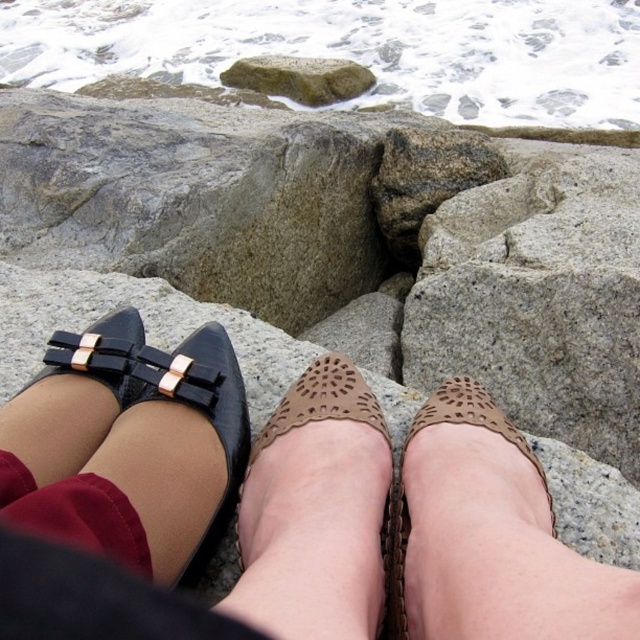
Based on the photo, you are standing at the edge of the ocean and want to place a small seashell on the black leather shoes at lower left and the gray rough rock at upper center. Which surface will the seashell stay on longer if placed there?

The seashell will stay longer on the gray rough rock at upper center because the black leather shoes at lower left has a lesser height compared to gray rough rock at upper center, making it more exposed to waves or water movement.

You are a photographer trying to capture both the black leather shoes at lower left and the brown perforated shoe at center in a single frame. Based on their positions, which shoe would appear larger in the photo?

The black leather shoes at lower left would appear larger in the photo because they are positioned closer to the camera compared to the brown perforated shoe at center.

You are a photographer trying to capture a close shot of the black leather flat at left and the red cotton sock at lower left. The camera lens can focus on objects within a 4 inch range. Will both items be in focus?

The black leather flat at left is 3.73 inches from the red cotton sock at lower left, so yes, both items will be within the 4 inch focus range and thus in focus.